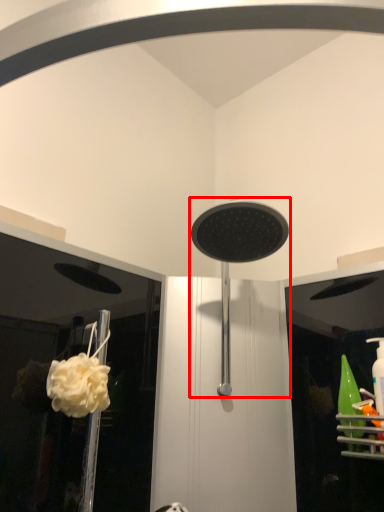
Question: In this image, where is shower (annotated by the red box) located relative to flower?

Choices:
 (A) right
 (B) left

Answer: (A)